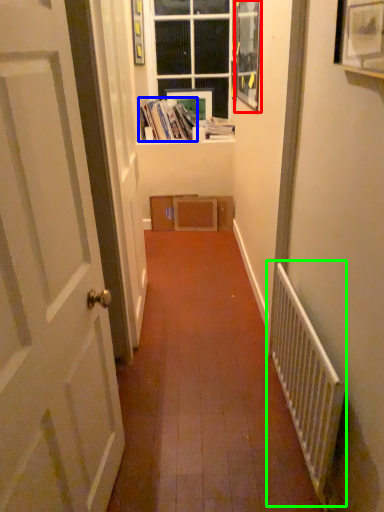
Question: Estimate the real-world distances between objects in this image. Which object is farther from picture frame (highlighted by a red box), book (highlighted by a blue box) or radiator (highlighted by a green box)?

Choices:
 (A) book
 (B) radiator

Answer: (B)